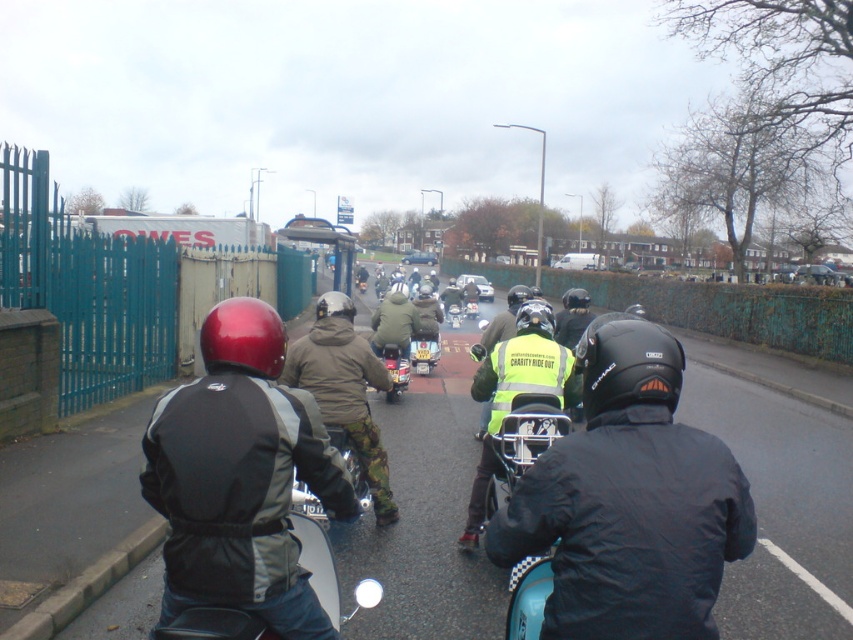
Question: Does camouflage pants at center have a lesser width compared to metallic gold motorcycle at center?

Choices:
 (A) yes
 (B) no

Answer: (B)

Question: Can you confirm if matte yellow motorcycle at center is positioned to the left of metallic silver scooter at center?

Choices:
 (A) no
 (B) yes

Answer: (A)

Question: Estimate the real-world distances between objects in this image. Which object is farther from the metallic gold motorcycle at center?

Choices:
 (A) matte black jacket at center
 (B) metallic silver scooter at center

Answer: (B)

Question: Is black matte helmet at center to the right of camouflage jacket at center from the viewer's perspective?

Choices:
 (A) no
 (B) yes

Answer: (B)

Question: Which point is farther to the camera?

Choices:
 (A) (395, 352)
 (B) (445, 316)
 (C) (405, 308)
 (D) (379, 371)

Answer: (B)

Question: Among these points, which one is nearest to the camera?

Choices:
 (A) (289, 356)
 (B) (448, 314)

Answer: (A)